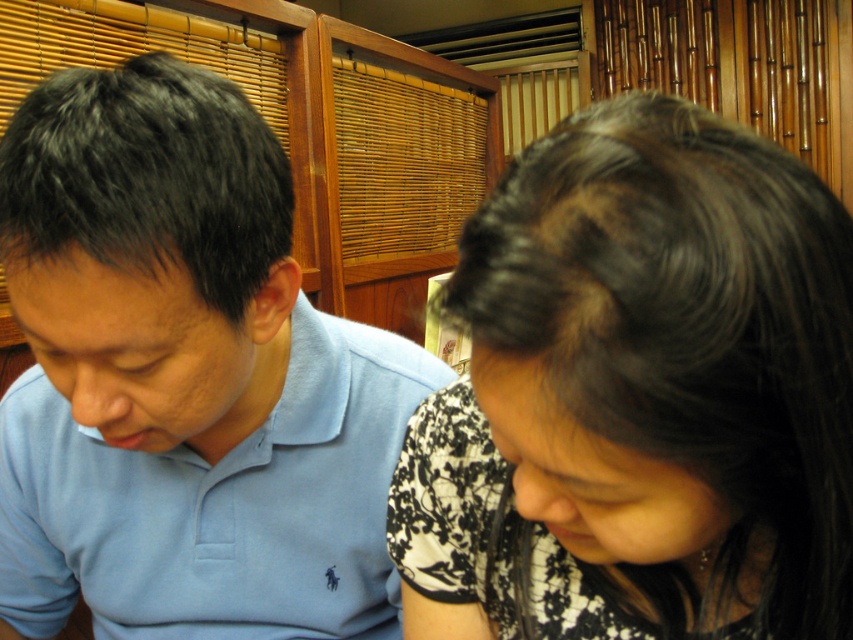
You are a photographer trying to capture a closeup of the black floral shirt at upper right without the light blue cotton polo shirt at left blocking the view. Is this possible given their positions?

The black floral shirt at upper right is in front of the light blue cotton polo shirt at left, so it is possible to capture a closeup of the black floral shirt at upper right without the light blue cotton polo shirt at left blocking the view.

You are a tailor measuring shirts for alterations. You see the black floral shirt at upper right and the light blue cotton polo shirt at left in the image. Which shirt requires a longer sleeve length adjustment?

The light blue cotton polo shirt at left requires a longer sleeve length adjustment because it is taller than the black floral shirt at upper right.